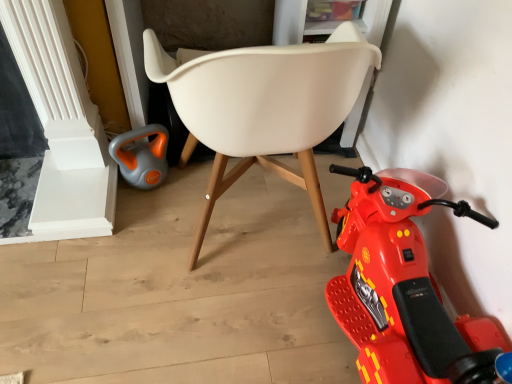
At what (x,y) coordinates should I click in order to perform the action: click on free space in front of gray-orange plastic kettle at lower left. Please return your answer as a coordinate pair (x, y). Looking at the image, I should click on (151, 218).